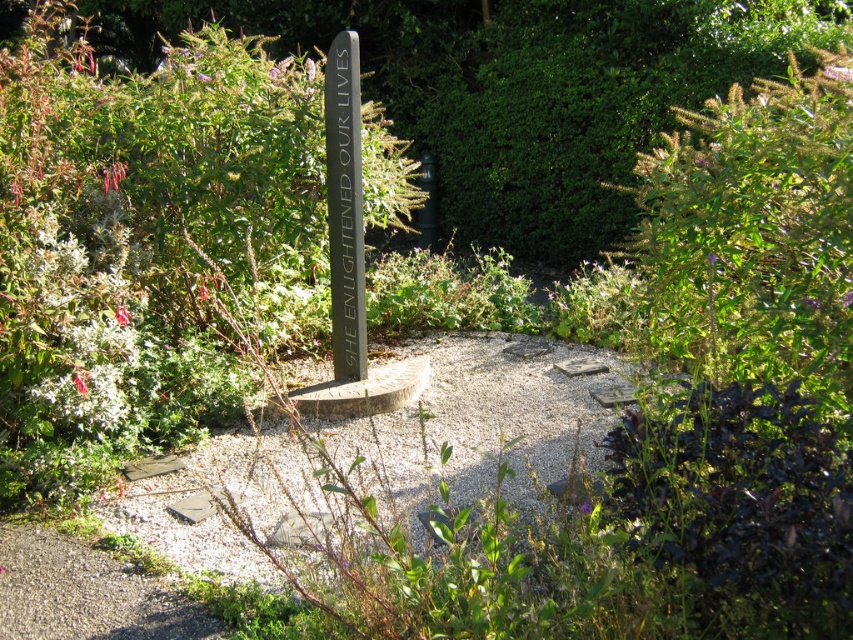
Based on the photo, is black polished stone sign at center smaller than black polished stone marker at center?

No, black polished stone sign at center is not smaller than black polished stone marker at center.

Who is positioned more to the right, black polished stone sign at center or black polished stone marker at center?

black polished stone marker at center is more to the right.

Between point (363, 330) and point (354, 250), which one is positioned in front?

Point (354, 250)

Identify the location of black polished stone sign at center. (345, 208).